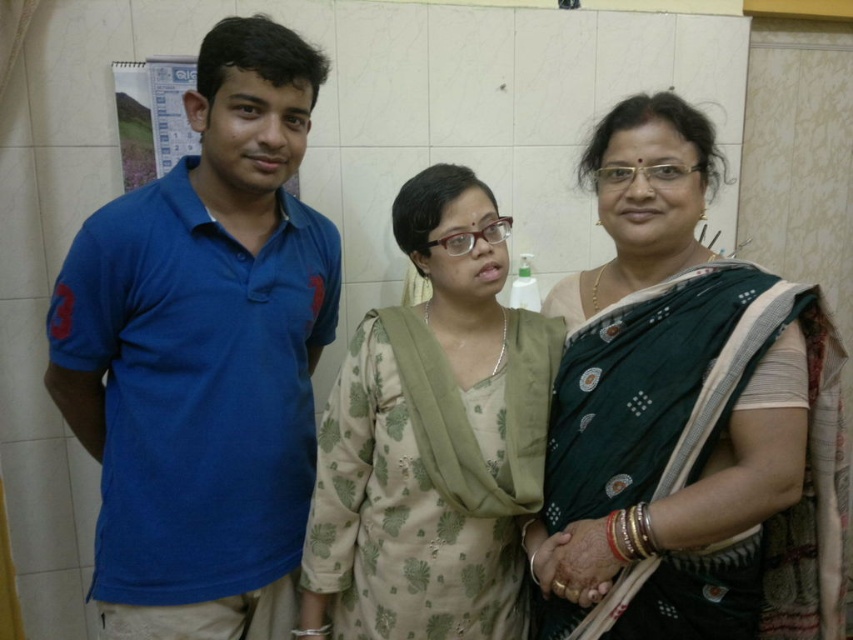
You are a photographer setting up for a group photo in a clinic. You have two subjects wearing the green silk saree at center and the light beige floral dress at center. Since space is limited, you need to know which outfit takes up more space. Which one requires more space?

The green silk saree at center is bigger than the light beige floral dress at center, so the green silk saree at center requires more space.

You are standing in the clinic and need to reach the door located at point (502, 470). There is an obstacle at point (80, 273). Can you walk straight to the door without going around the obstacle?

Point (80, 273) is in front of point (502, 470). Since the obstacle is in front of the door, you cannot walk straight to the door without going around the obstacle.